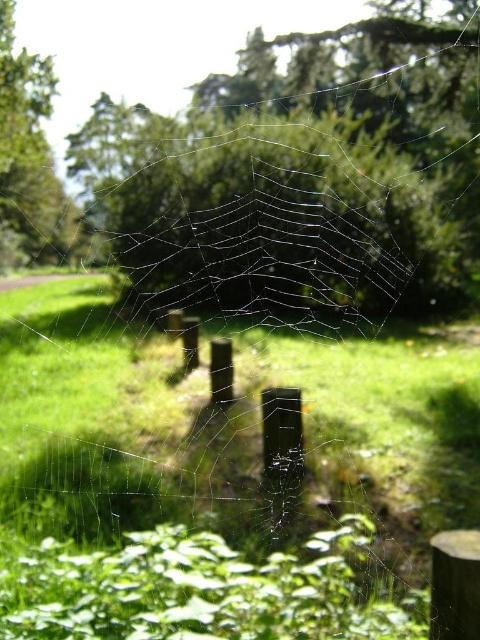
Question: Among these points, which one is farthest from the camera?

Choices:
 (A) (455, 132)
 (B) (12, 116)
 (C) (238, 538)

Answer: (B)

Question: From the image, what is the correct spatial relationship of green grass at center in relation to transparent web at center?

Choices:
 (A) left
 (B) right

Answer: (B)

Question: Which of the following is the farthest from the observer?

Choices:
 (A) green grass at center
 (B) transparent web at center

Answer: (B)

Question: Which of the following is the closest to the observer?

Choices:
 (A) (52, 300)
 (B) (22, 148)

Answer: (A)

Question: Is green grass at center bigger than transparent web at center?

Choices:
 (A) no
 (B) yes

Answer: (A)

Question: Observing the image, what is the correct spatial positioning of green grass at center in reference to green leafy tree at upper left?

Choices:
 (A) above
 (B) below

Answer: (B)